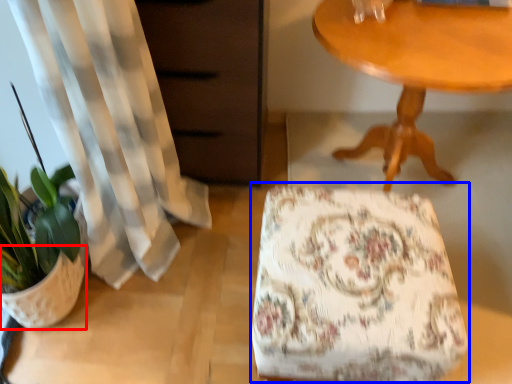
Question: Which object appears closest to the camera in this image, flowerpot (highlighted by a red box) or rocking chair (highlighted by a blue box)?

Choices:
 (A) flowerpot
 (B) rocking chair

Answer: (B)